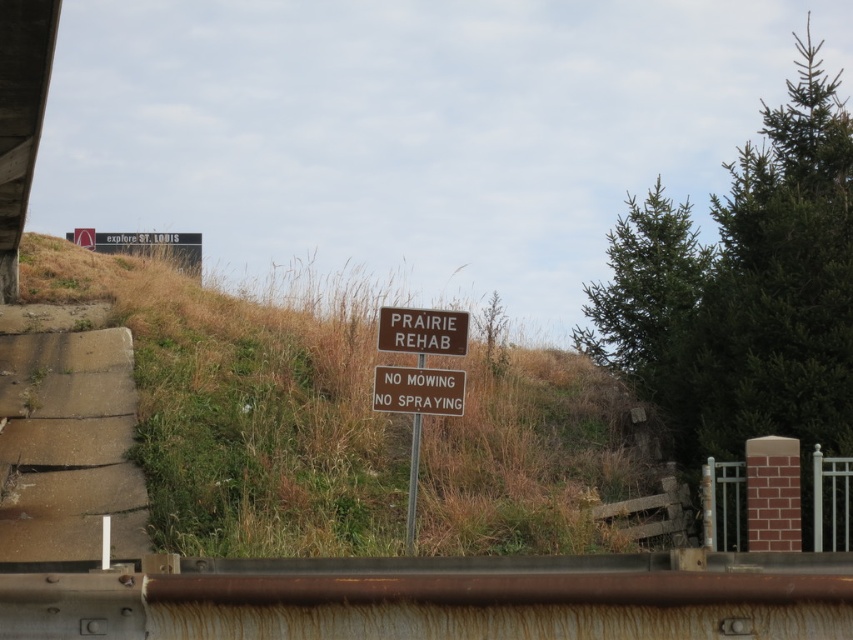
You are a landscape architect designing a path that must pass between the concrete at left and the brown wooden sign at center. The path needs to be 3 meters wide. Can the space between them accommodate this width?

The concrete at left is wider than the brown wooden sign at center. However, the exact distance between them isn not specified in the provided description. Without knowing the actual spacing, it is impossible to determine if the 3 meter path would fit.

You are standing at point [456,371] and want to walk to the sign that reads PRAIRIE REHAB. Is the point [305,480] behind you or in front of you as you face the sign?

Point [305,480] is behind point [456,371], so it is behind you as you face the sign.

You are a delivery driver who needs to pass by the brown metal sign at center and the brown wooden sign at center. The space between them is narrow. Can your truck, which is 8.5 feet wide, fit through the gap between the two signs?

The gap between the brown metal sign at center and the brown wooden sign at center is only 8.38 inches, which is much narrower than the truck that is 8.5 feet wide. The truck cannot fit through the gap between the brown metal sign at center and the brown wooden sign at center.